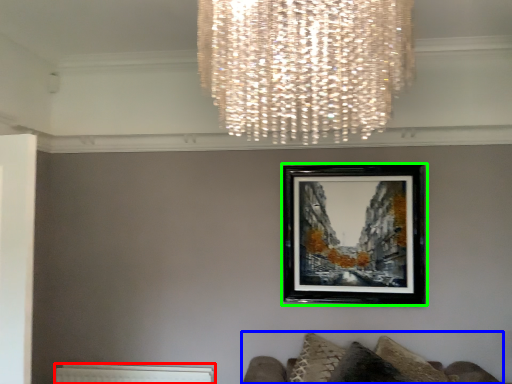
Question: Estimate the real-world distances between objects in this image. Which object is farther from radiator (highlighted by a red box), furniture (highlighted by a blue box) or picture frame (highlighted by a green box)?

Choices:
 (A) furniture
 (B) picture frame

Answer: (B)